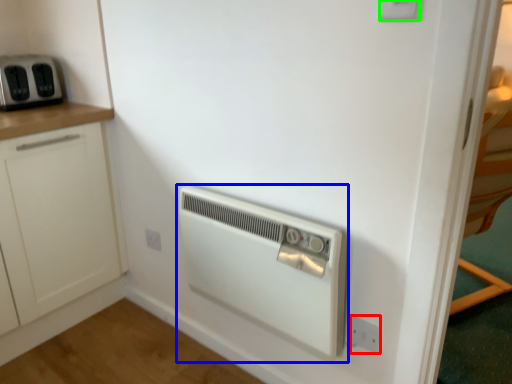
Question: Which object is the farthest from electric outlet (highlighted by a red box)? Choose among these: home appliance (highlighted by a blue box) or electric outlet (highlighted by a green box).

Choices:
 (A) home appliance
 (B) electric outlet

Answer: (B)